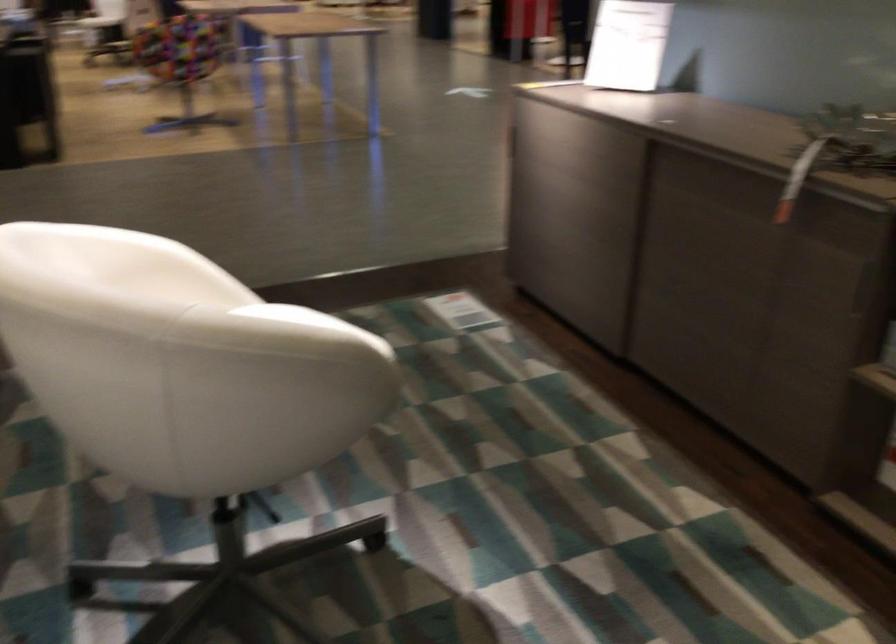
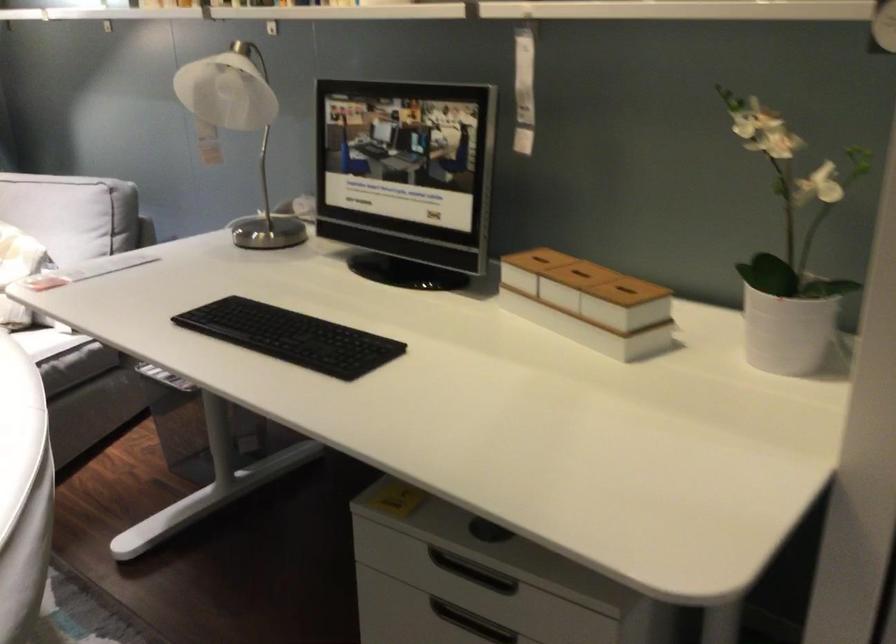
Find the pixel in the second image that matches point (98, 248) in the first image.

(22, 489)